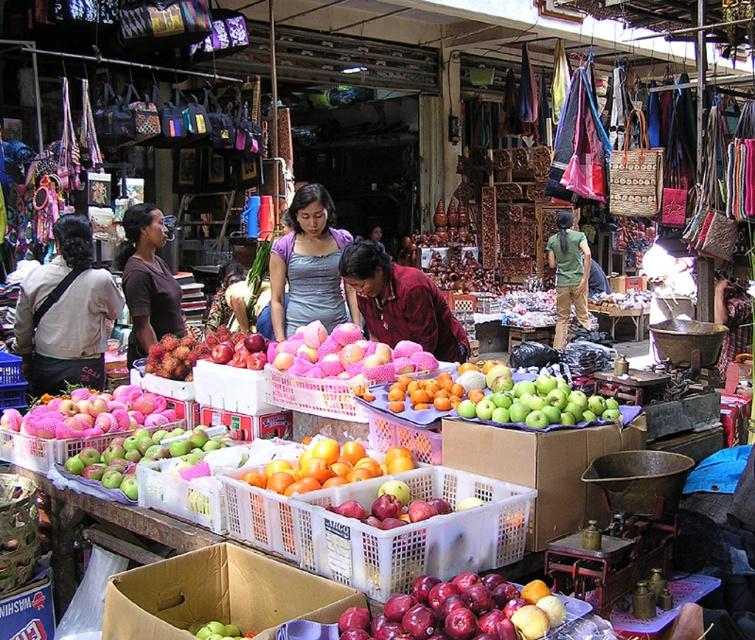
You are a customer at the market and want to reach the point marked as point (x=296, y=483). You are currently standing at point (x=509, y=381). Can you walk directly towards the first point without any obstacles between them?

Yes, you can walk directly towards point (x=296, y=483) because it is in front of point (x=509, y=381), meaning there are no obstacles blocking the path between them.